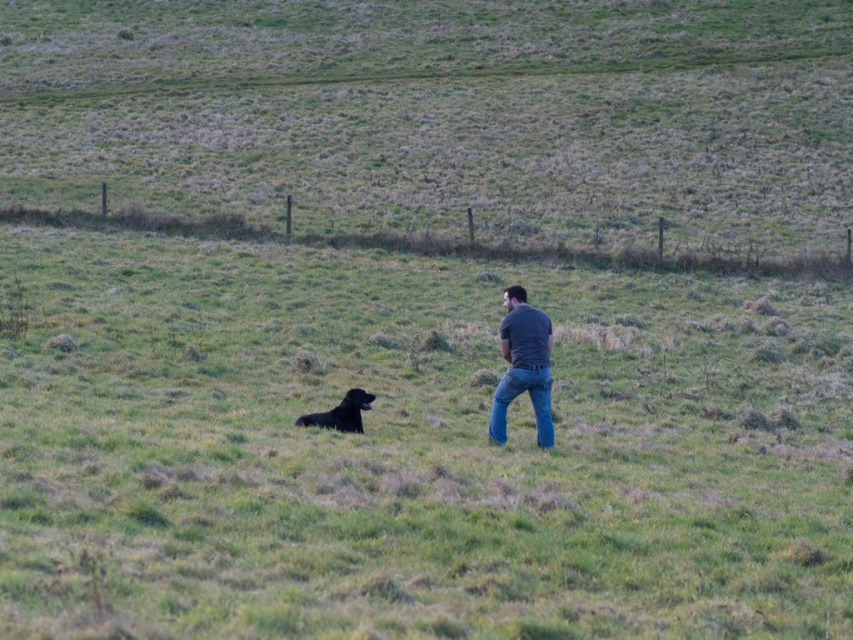
The height and width of the screenshot is (640, 853). I want to click on dark gray t-shirt at center, so click(523, 365).

Who is more forward, (543, 336) or (310, 420)?

Point (543, 336) is in front.

This screenshot has width=853, height=640. Find the location of `dark gray t-shirt at center`. dark gray t-shirt at center is located at coordinates (523, 365).